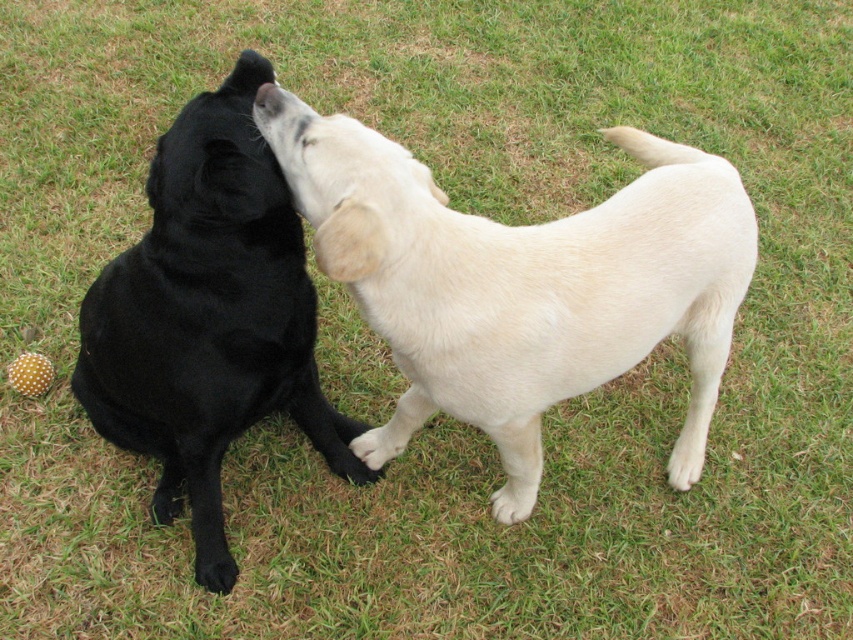
Between shiny white dog at center and black matte dog at center, which one is positioned higher?

shiny white dog at center is higher up.

Which is more to the left, shiny white dog at center or black matte dog at center?

black matte dog at center is more to the left.

Locate an element on the screen. Image resolution: width=853 pixels, height=640 pixels. shiny white dog at center is located at coordinates (520, 284).

Find the location of a particular element. shiny white dog at center is located at coordinates 520,284.